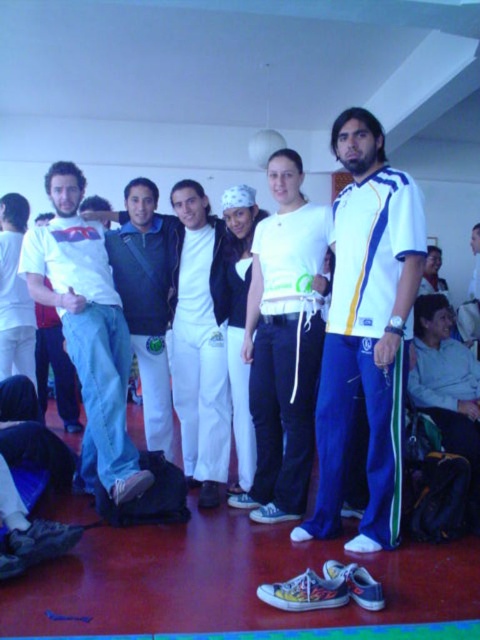
Question: Can you confirm if white jersey at center is positioned below white cotton t-shirt at left?

Choices:
 (A) no
 (B) yes

Answer: (A)

Question: Which object appears farthest from the camera in this image?

Choices:
 (A) white cotton t-shirt at left
 (B) white jersey at center

Answer: (A)

Question: Can you confirm if white jersey at center is positioned to the right of white cotton t-shirt at left?

Choices:
 (A) yes
 (B) no

Answer: (A)

Question: Is white jersey at center smaller than white cotton t-shirt at left?

Choices:
 (A) yes
 (B) no

Answer: (A)

Question: Among these points, which one is nearest to the camera?

Choices:
 (A) (120, 324)
 (B) (354, 241)

Answer: (B)